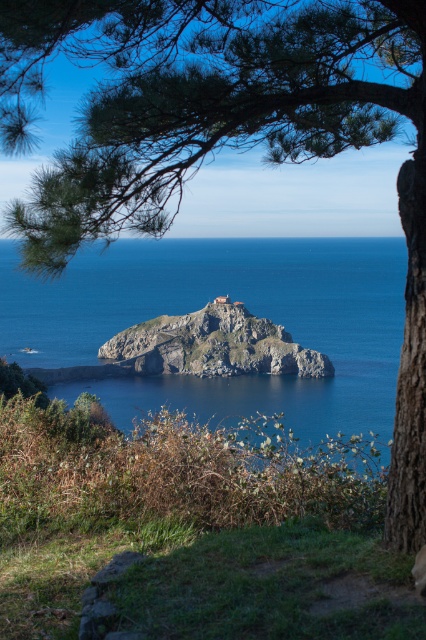
Which is above, blue water at center or brown rocky island at center?

Positioned higher is blue water at center.

How much distance is there between blue water at center and brown rocky island at center?

The distance of blue water at center from brown rocky island at center is 5.88 meters.

Is point (36, 296) positioned behind point (150, 326)?

Yes.

Find the location of a particular element. The image size is (426, 640). blue water at center is located at coordinates (232, 300).